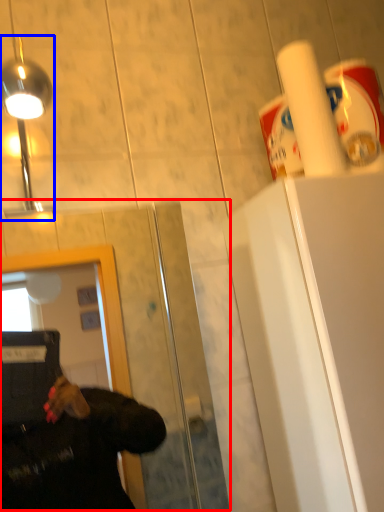
Question: Which point is closer to the camera, glass door (highlighted by a red box) or light fixture (highlighted by a blue box)?

Choices:
 (A) glass door
 (B) light fixture

Answer: (A)